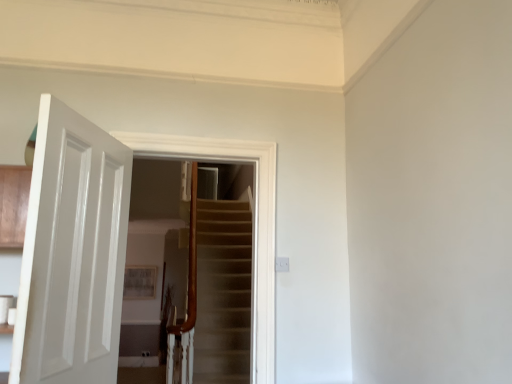
Question: Considering the relative positions of white glossy door at center and white glossy door at left in the image provided, is white glossy door at center to the left or to the right of white glossy door at left?

Choices:
 (A) left
 (B) right

Answer: (B)

Question: In terms of size, does white glossy door at center appear bigger or smaller than white glossy door at left?

Choices:
 (A) big
 (B) small

Answer: (A)

Question: Which is correct: white glossy door at center is inside white glossy door at left, or outside of it?

Choices:
 (A) outside
 (B) inside

Answer: (A)

Question: From a real-world perspective, is white glossy door at left physically located above or below white glossy door at center?

Choices:
 (A) below
 (B) above

Answer: (A)

Question: Is white glossy door at left situated inside white glossy door at center or outside?

Choices:
 (A) inside
 (B) outside

Answer: (B)

Question: From the image's perspective, relative to white glossy door at center, is white glossy door at left above or below?

Choices:
 (A) above
 (B) below

Answer: (B)

Question: In terms of height, does white glossy door at left look taller or shorter compared to white glossy door at center?

Choices:
 (A) short
 (B) tall

Answer: (A)